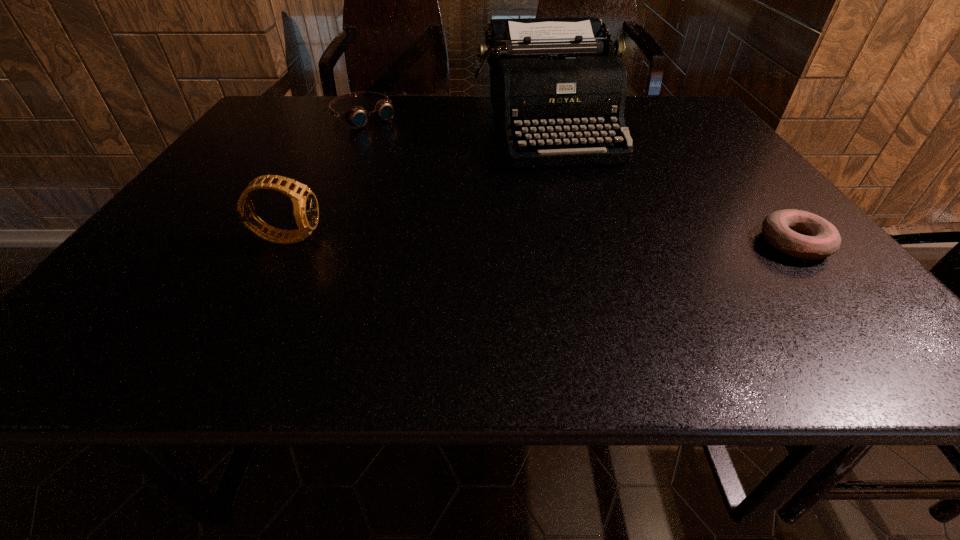
This screenshot has height=540, width=960. Find the location of `free space on the desktop that is between the watch and the doughnut and is positioned on the typing side of the typewriter`. free space on the desktop that is between the watch and the doughnut and is positioned on the typing side of the typewriter is located at coordinates (598, 241).

Where is `vacant space on the desktop that is between the watch and the shortest object and is positioned through the lenses of the goggles`? vacant space on the desktop that is between the watch and the shortest object and is positioned through the lenses of the goggles is located at coordinates (514, 240).